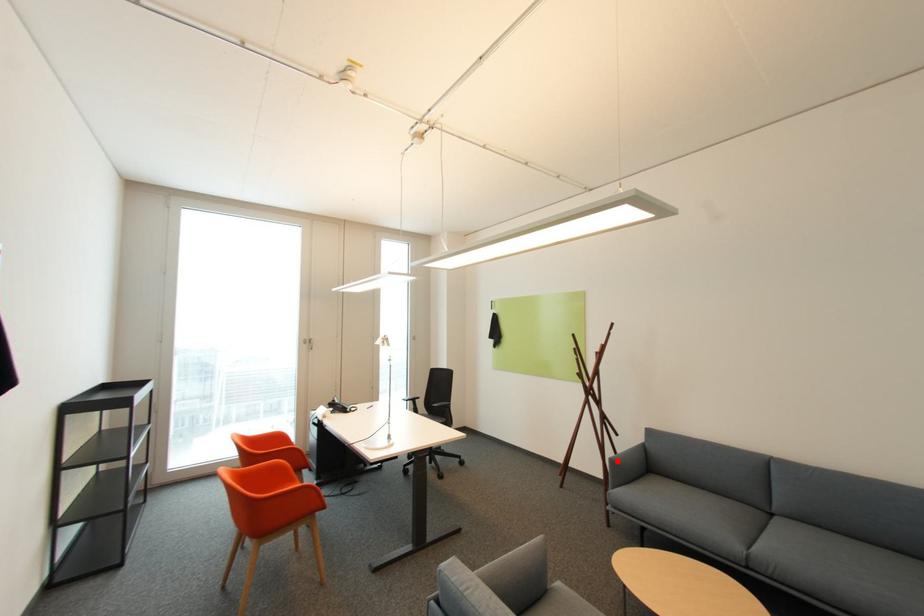
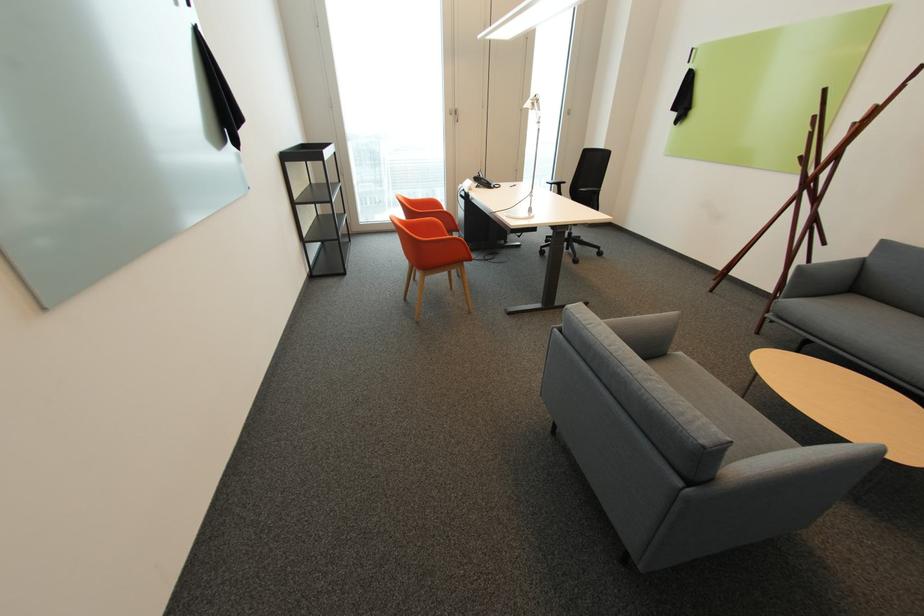
Where in the second image is the point corresponding to the highlighted location from the first image?

(806, 268)